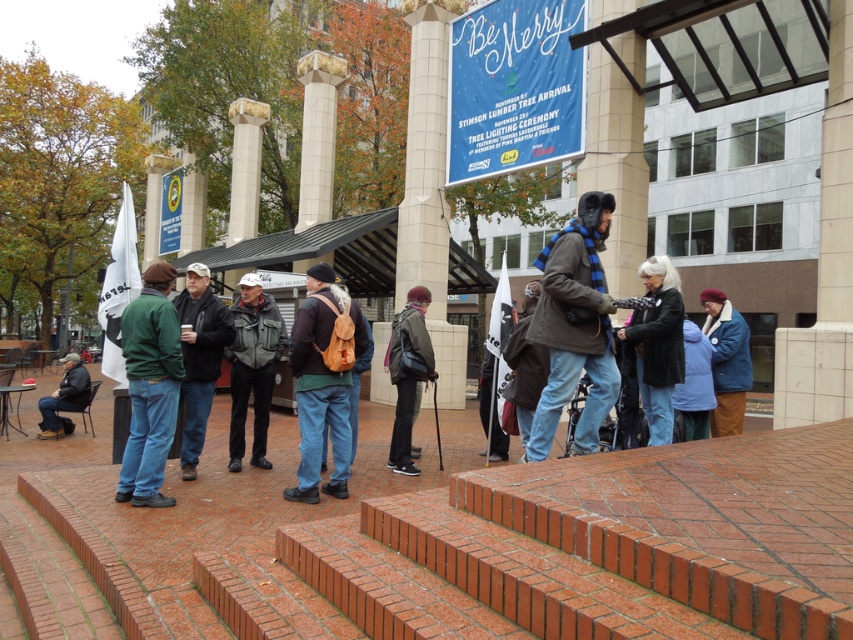
Question: Can you confirm if white hair at center is bigger than blue woolen scarf at center?

Choices:
 (A) no
 (B) yes

Answer: (A)

Question: Estimate the real-world distances between objects in this image. Which object is closer to the brown leather jacket at center?

Choices:
 (A) blue fuzzy coat at lower right
 (B) black jacket at center
 (C) green matte jacket at center
 (D) dark gray jacket at lower left

Answer: (A)

Question: Which point is farther from the camera taking this photo?

Choices:
 (A) (244, 419)
 (B) (666, 374)
 (C) (723, 337)

Answer: (C)

Question: Among these points, which one is nearest to the camera?

Choices:
 (A) (546, 333)
 (B) (254, 314)
 (C) (79, 385)
 (D) (403, 417)

Answer: (A)

Question: Is brown leather backpack at center closer to the viewer compared to blue fuzzy coat at lower right?

Choices:
 (A) yes
 (B) no

Answer: (A)

Question: Is dark gray backpack at center closer to camera compared to blue fuzzy coat at lower right?

Choices:
 (A) yes
 (B) no

Answer: (B)